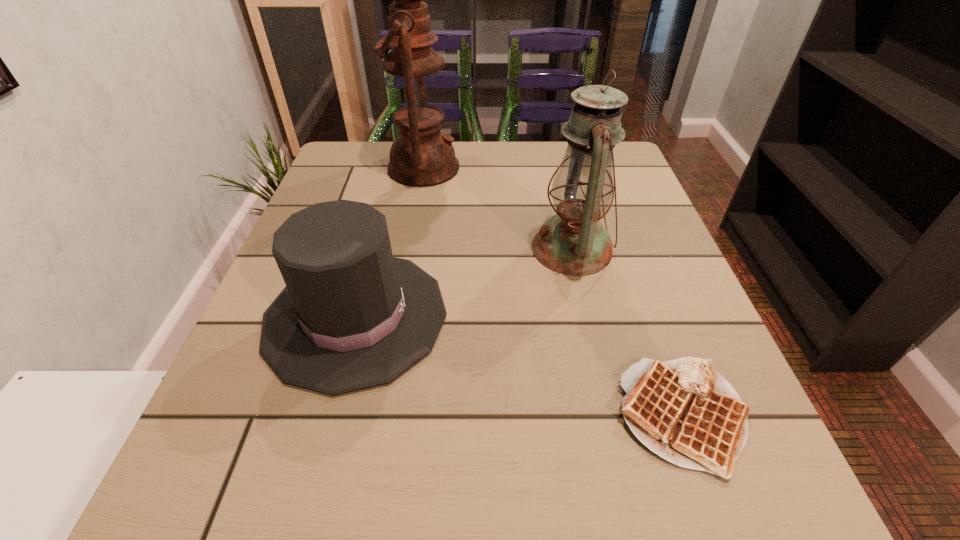
Locate an element on the screen. Image resolution: width=960 pixels, height=540 pixels. object that is at the near edge is located at coordinates (683, 410).

Locate an element on the screen. The height and width of the screenshot is (540, 960). oil lamp present at the left edge is located at coordinates pyautogui.click(x=421, y=156).

You are a GUI agent. You are given a task and a screenshot of the screen. Output one action in this format:
    pyautogui.click(x=<x>, y=<y>)
    Task: Click on the dress hat that is at the left edge
    The width and height of the screenshot is (960, 540).
    Given the screenshot: What is the action you would take?
    pyautogui.click(x=351, y=317)

Where is `oil lamp at the right edge`? This screenshot has width=960, height=540. oil lamp at the right edge is located at coordinates (573, 242).

At what (x,y) coordinates should I click in order to perform the action: click on waffle located in the right edge section of the desktop. Please return your answer as a coordinate pair (x, y). Looking at the image, I should click on (683, 410).

This screenshot has width=960, height=540. I want to click on object at the far left corner, so click(x=421, y=156).

Locate an element on the screen. The width and height of the screenshot is (960, 540). object that is at the near right corner is located at coordinates tap(683, 410).

Locate an element on the screen. The height and width of the screenshot is (540, 960). free region at the far edge of the desktop is located at coordinates (493, 188).

Where is `vacant space at the near edge of the desktop`? This screenshot has width=960, height=540. vacant space at the near edge of the desktop is located at coordinates (582, 492).

Identify the location of free space at the left edge. (382, 196).